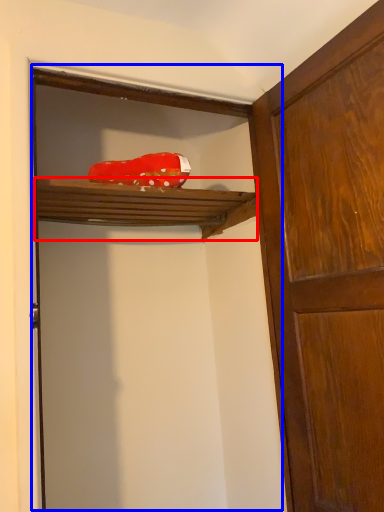
Question: Which of the following is the closest to the observer, shelf (highlighted by a red box) or door (highlighted by a blue box)?

Choices:
 (A) shelf
 (B) door

Answer: (B)